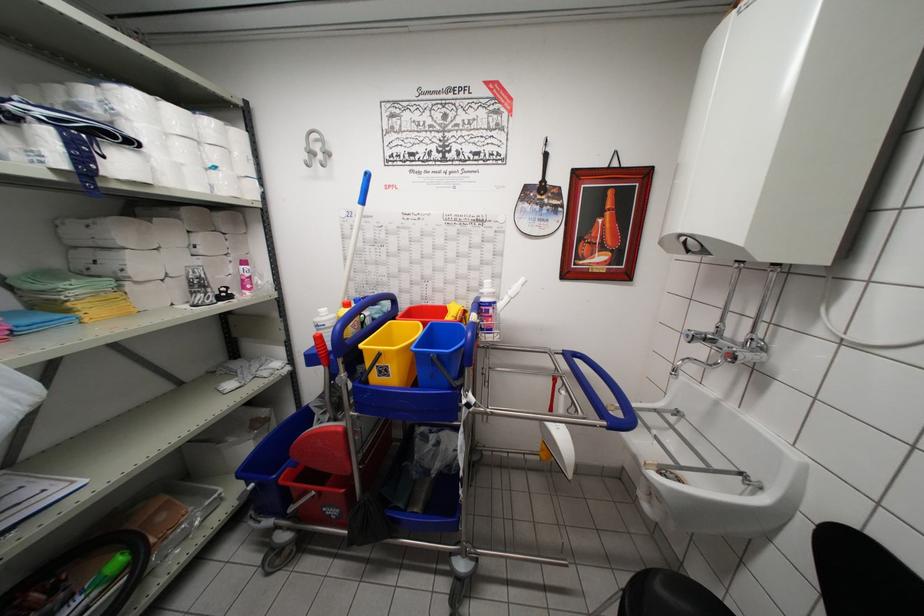
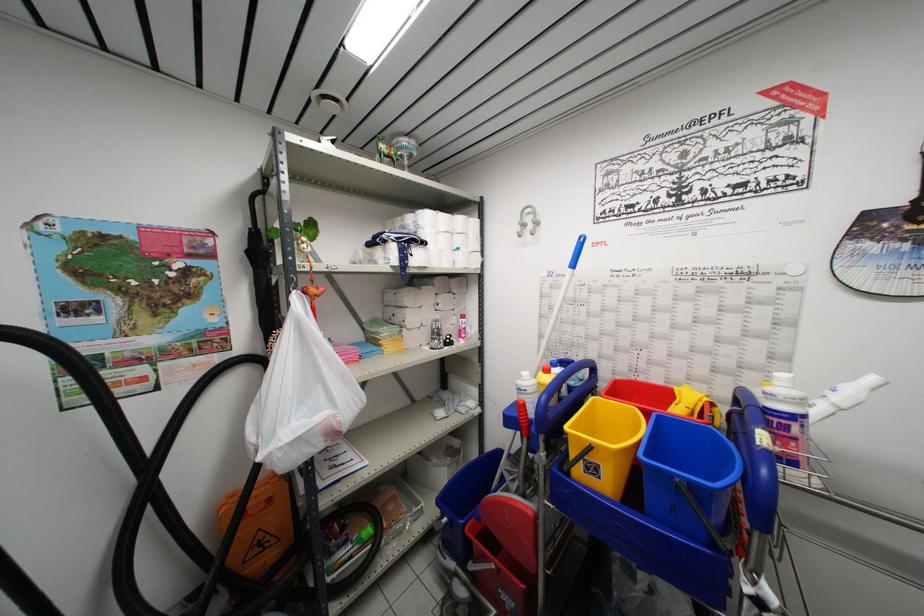
Where in the second image is the point corresponding to point 325,146 from the first image?

(537, 217)